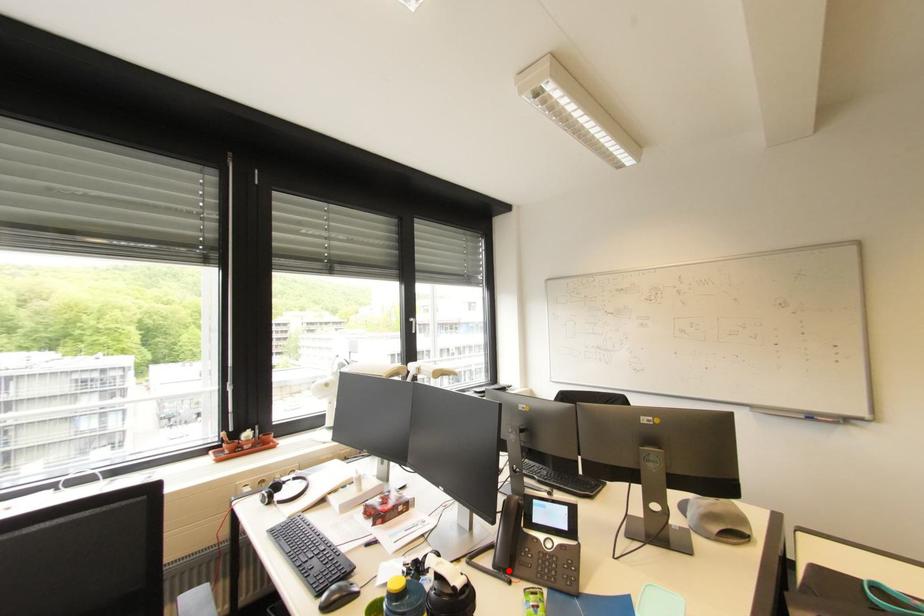
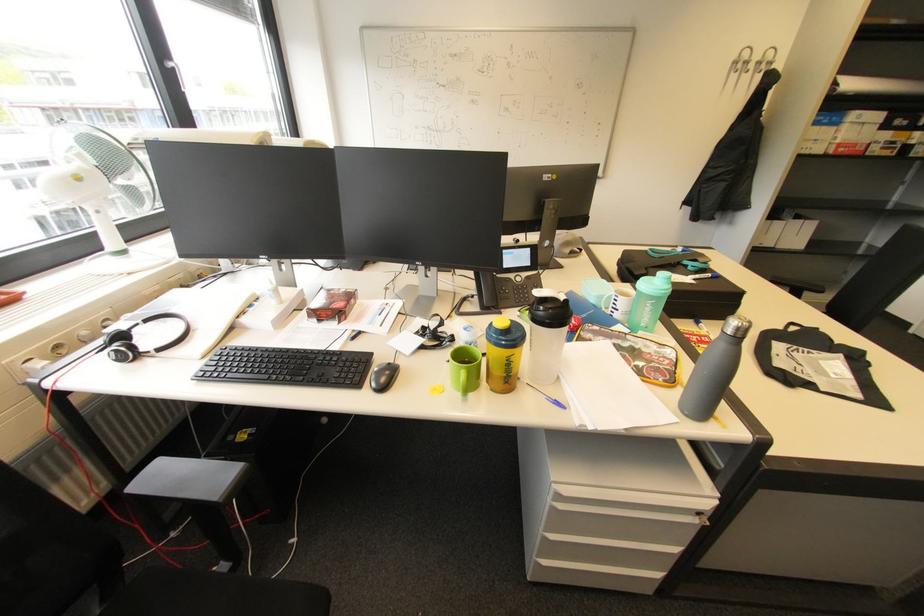
Locate, in the second image, the point that corresponds to the highlighted location in the first image.

(496, 308)